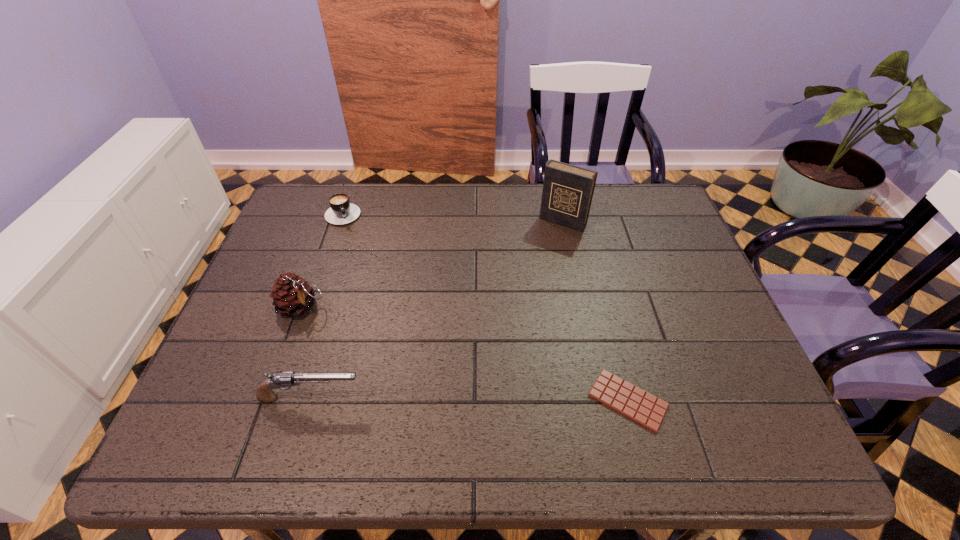
The width and height of the screenshot is (960, 540). What are the coordinates of `free space on the desktop that is between the gun and the shortest object and is positioned with a leaf charm attached to the pinecone` in the screenshot? It's located at (457, 399).

What are the coordinates of `free spot on the desktop that is between the third shortest object and the shortest object and is positioned with the handle on the side of the fourth tallest object` in the screenshot? It's located at (426, 399).

Locate an element on the screen. vacant space on the desktop that is between the gun and the candy bar and is positioned on the front cover of the diary is located at coordinates pos(446,399).